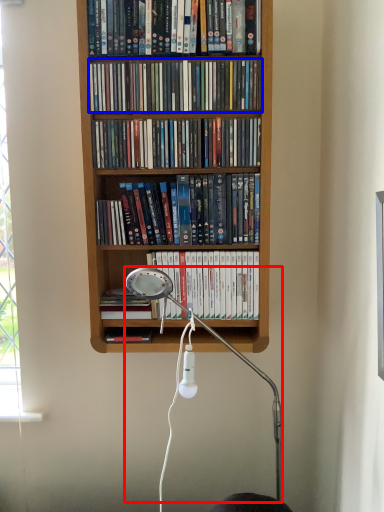
Question: Which object appears closest to the camera in this image, lamp (highlighted by a red box) or book (highlighted by a blue box)?

Choices:
 (A) lamp
 (B) book

Answer: (A)